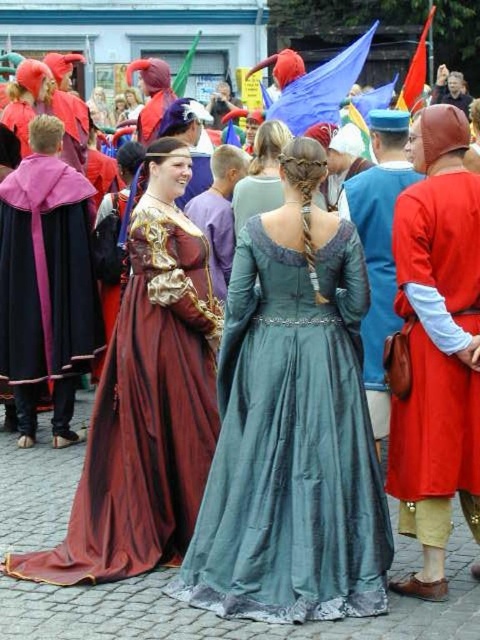
Question: Where is matte burgundy gown at center located in relation to matte red tunic at right in the image?

Choices:
 (A) right
 (B) left

Answer: (B)

Question: Which of these objects is positioned farthest from the matte red tunic at right?

Choices:
 (A) matte burgundy gown at center
 (B) velvet maroon cape at left

Answer: (B)

Question: Observing the image, what is the correct spatial positioning of silky teal gown at center in reference to velvet maroon cape at left?

Choices:
 (A) below
 (B) above

Answer: (A)

Question: Among these points, which one is nearest to the camera?

Choices:
 (A) (100, 426)
 (B) (223, 452)

Answer: (B)

Question: Estimate the real-world distances between objects in this image. Which object is farther from the matte burgundy gown at center?

Choices:
 (A) silky teal gown at center
 (B) matte red tunic at right
 (C) velvet maroon cape at left

Answer: (C)

Question: Does matte red tunic at right have a larger size compared to velvet maroon cape at left?

Choices:
 (A) no
 (B) yes

Answer: (A)